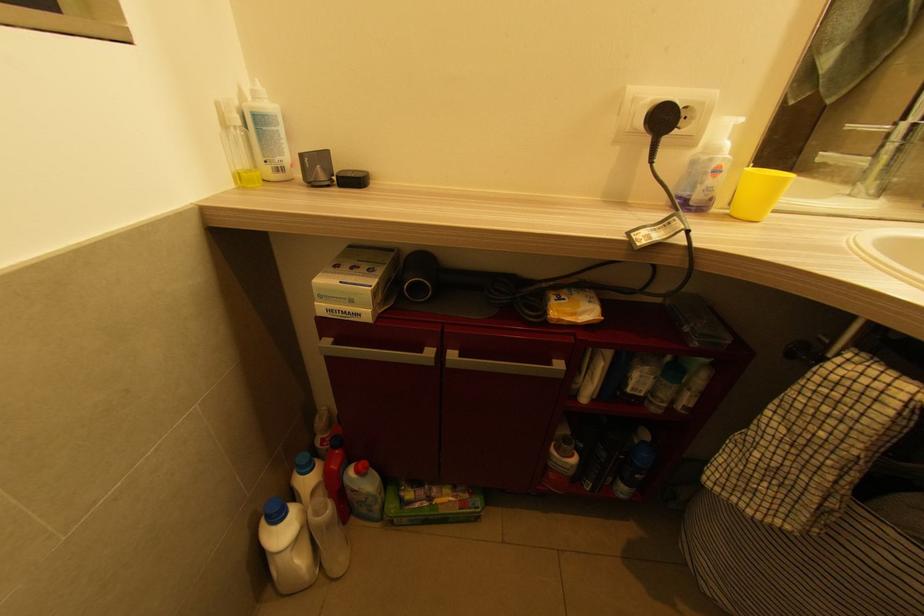
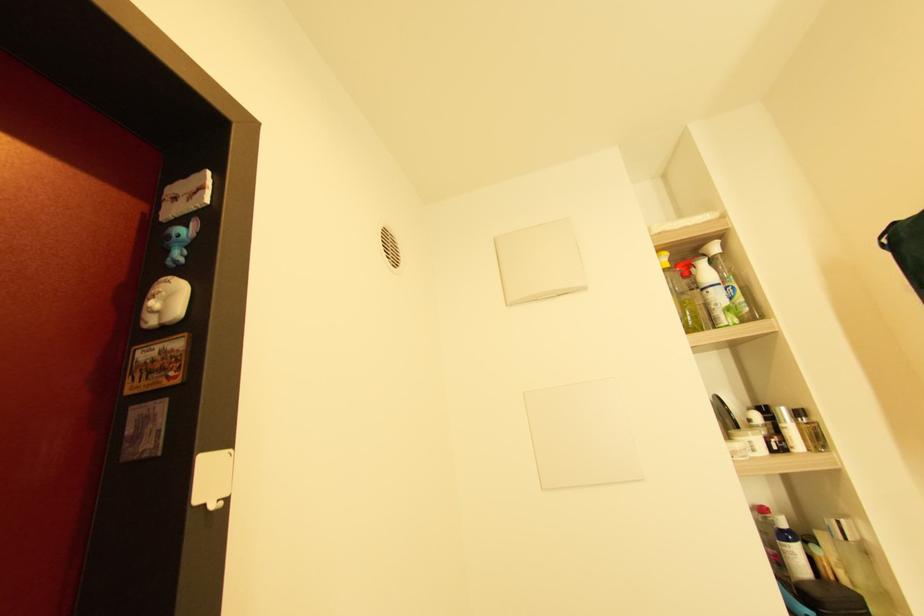
Question: Based on the continuous images, in which direction is the camera rotating? Reply with the corresponding letter.

Choices:
 (A) Left
 (B) Right
 (C) Up
 (D) Down

Answer: (A)